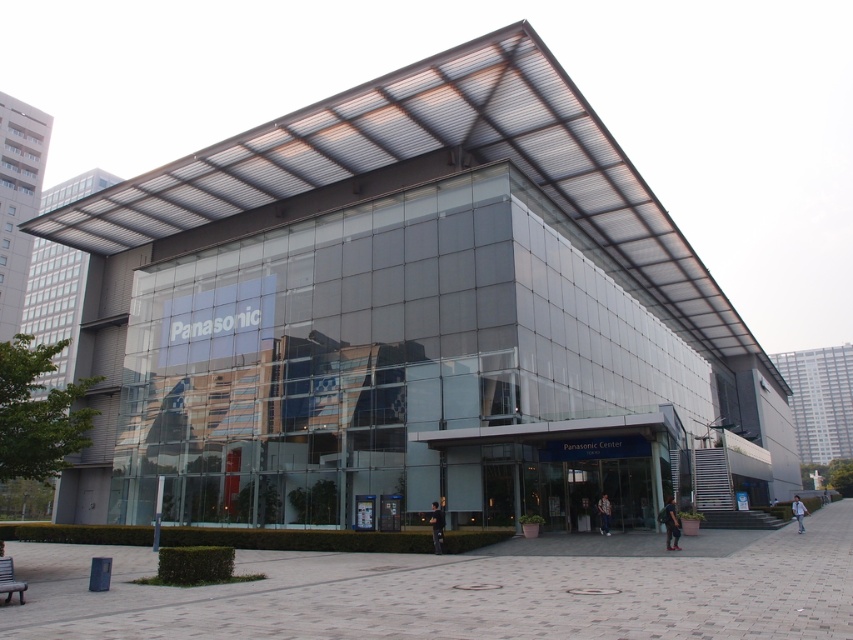
You are standing in front of the Panasonic Center building. There are two points marked on the glass facade. The first point is at coordinate point (666,541) and the second is at point (605,522). Which of these points appears closer to you?

Point (666,541) is closer to the viewer than point (605,522).